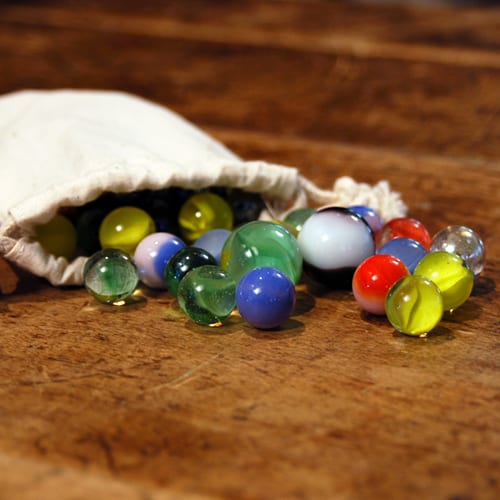
Where is `yellow marble`? The height and width of the screenshot is (500, 500). yellow marble is located at coordinates (130, 225), (59, 229), (206, 216), (419, 298), (452, 277).